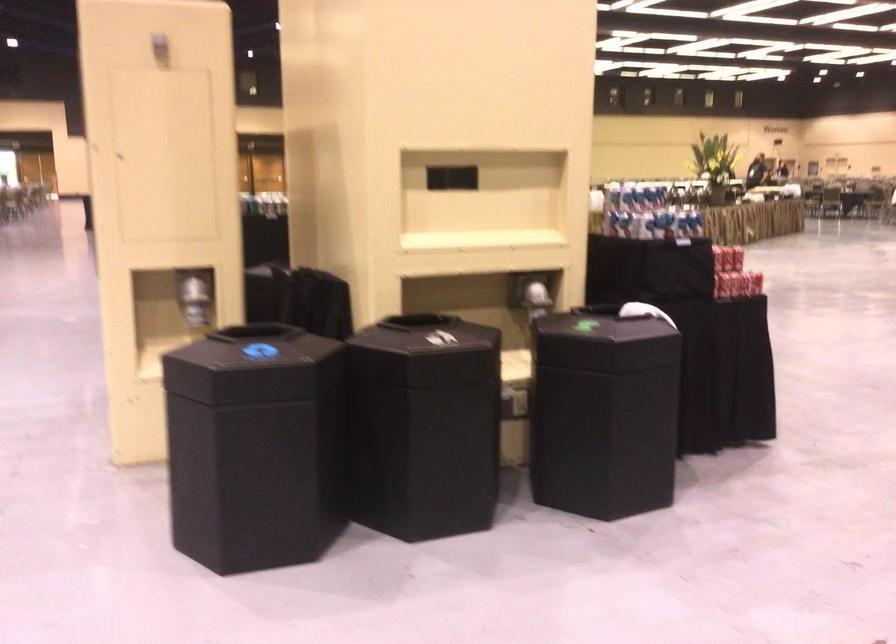
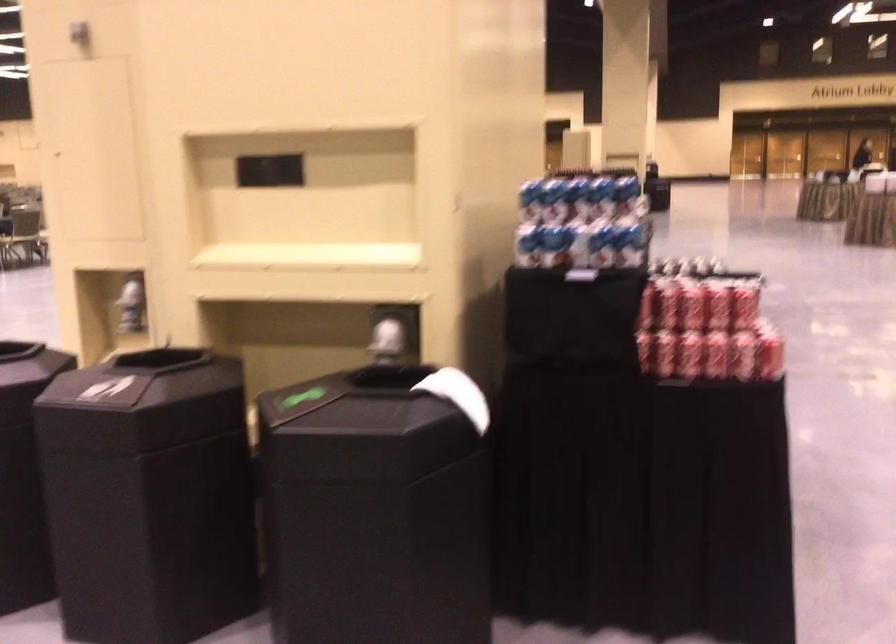
Find the pixel in the second image that matches pixel 660 314 in the first image.

(458, 395)